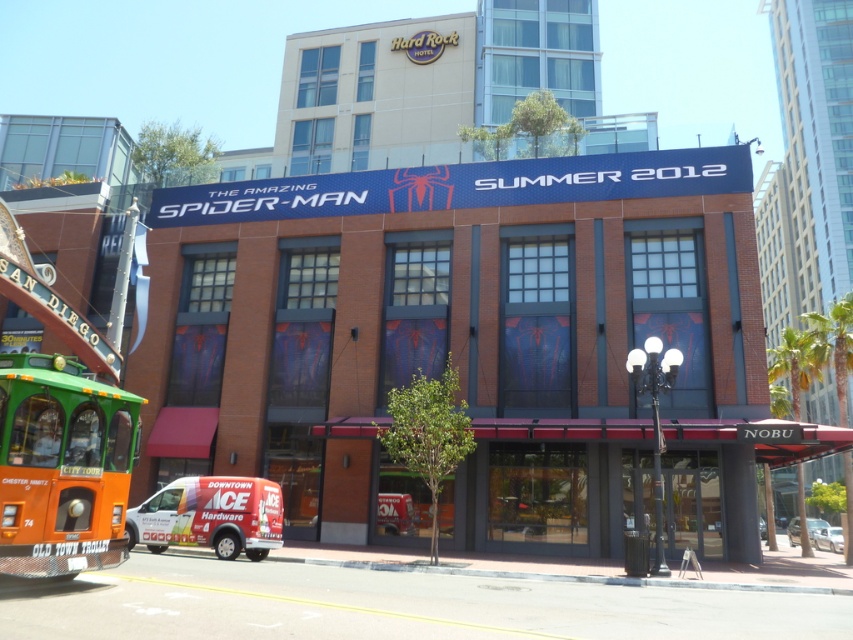
You are a delivery person who needs to load a box onto the orange matte trolley at lower left and the white vinyl van at lower left. Which vehicle can you place the box on top without bending down?

The orange matte trolley at lower left has a greater height compared to the white vinyl van at lower left, so you can place the box on top of the orange matte trolley at lower left without bending down.

You are a pedestrian standing on the sidewalk in front of the building. You see an orange matte trolley at lower left and a white vinyl van at lower left. Which one is closer to you?

The orange matte trolley at lower left is closer to you because it is positioned over the white vinyl van at lower left, indicating it is in front.